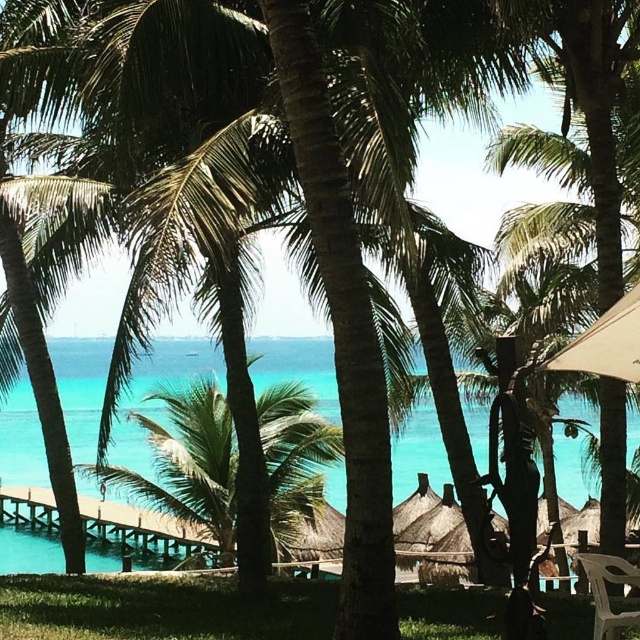
Question: Which point is closer to the camera?

Choices:
 (A) green leafy palm tree at center
 (B) beige fabric umbrella at right
 (C) white plastic chair at lower right

Answer: (B)

Question: Does beige fabric umbrella at right have a lesser width compared to white plastic chair at lower right?

Choices:
 (A) no
 (B) yes

Answer: (A)

Question: Does turquoise water at center appear over beige fabric umbrella at right?

Choices:
 (A) no
 (B) yes

Answer: (A)

Question: Estimate the real-world distances between objects in this image. Which object is farther from the wooden pier at lower left?

Choices:
 (A) turquoise water at center
 (B) white plastic chair at lower right

Answer: (B)

Question: Considering the real-world distances, which object is farthest from the turquoise water at center?

Choices:
 (A) wooden pier at lower left
 (B) green leafy palm tree at center
 (C) white plastic chair at lower right
 (D) beige fabric umbrella at right

Answer: (C)

Question: Is green leafy palm tree at center positioned at the back of white plastic chair at lower right?

Choices:
 (A) yes
 (B) no

Answer: (A)